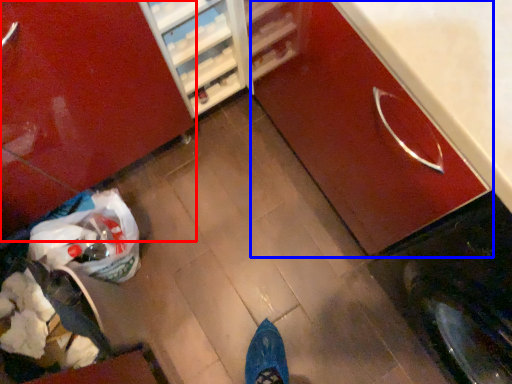
Question: Among these objects, which one is farthest to the camera, cabinetry (highlighted by a red box) or cabinetry (highlighted by a blue box)?

Choices:
 (A) cabinetry
 (B) cabinetry

Answer: (A)